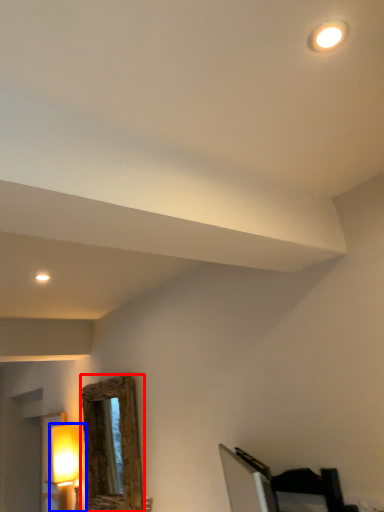
Question: Among these objects, which one is farthest to the camera, mirror (highlighted by a red box) or lamp (highlighted by a blue box)?

Choices:
 (A) mirror
 (B) lamp

Answer: (B)